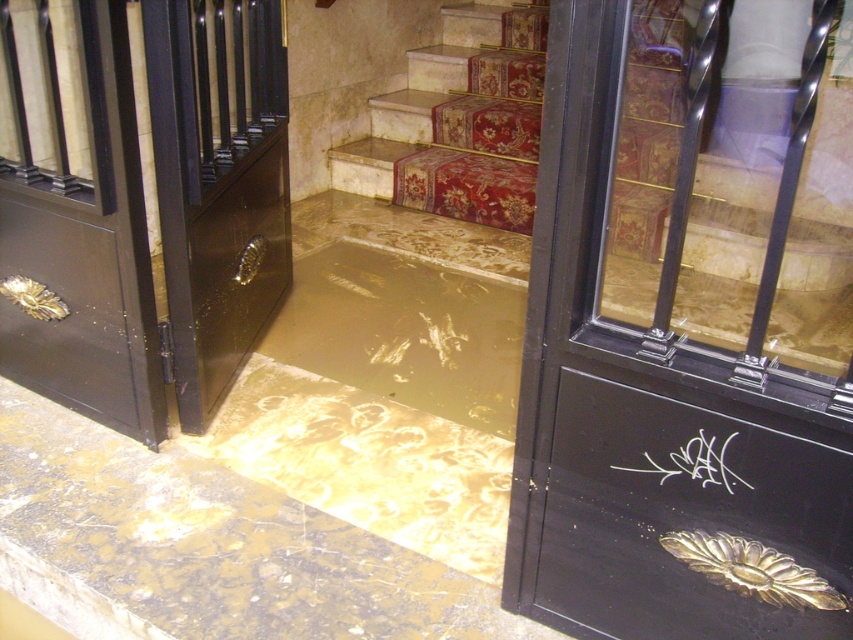
Between point (335, 269) and point (508, 198), which one is positioned in front?

Positioned in front is point (335, 269).

Does point (413, 397) lie in front of point (425, 86)?

Yes, it is.

The width and height of the screenshot is (853, 640). Find the location of `brown/muddy water at center`. brown/muddy water at center is located at coordinates (405, 332).

Is black glass door at center thinner than brown/muddy water at center?

In fact, black glass door at center might be wider than brown/muddy water at center.

Does point (776, 257) come farther from viewer compared to point (346, 301)?

No, (776, 257) is closer to viewer.

Find the location of a particular element. This screenshot has height=640, width=853. black glass door at center is located at coordinates (689, 324).

Does black glass door at center have a lesser width compared to red carpeted stairs at upper center?

Yes, black glass door at center is thinner than red carpeted stairs at upper center.

Is black glass door at center below red carpeted stairs at upper center?

Correct, black glass door at center is located below red carpeted stairs at upper center.

Is point (743, 305) closer to camera compared to point (531, 3)?

Yes, it is in front of point (531, 3).

Where is `black glass door at center`? The image size is (853, 640). black glass door at center is located at coordinates (689, 324).